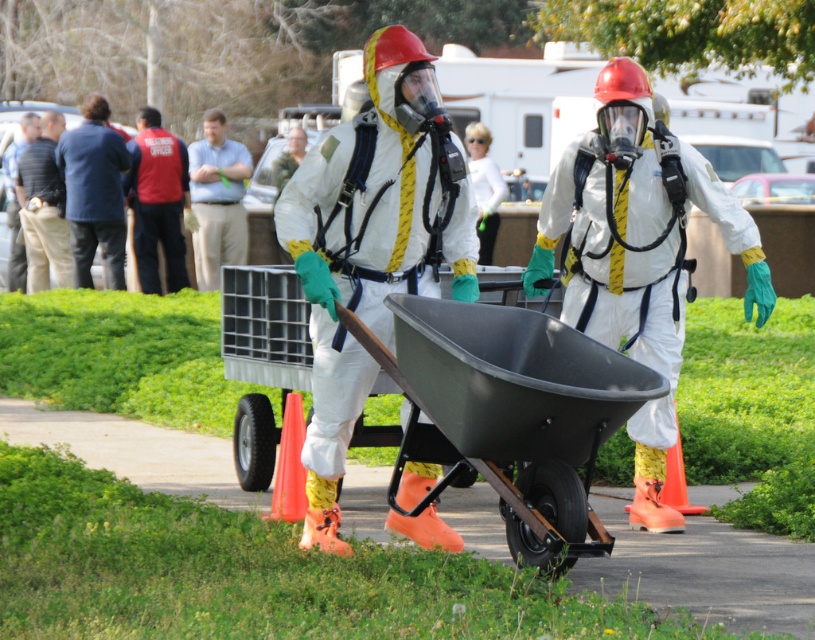
You are standing in front of the image and want to determine which of the two points, point (613, 378) or point (29, 289), is closer to you. Based on the scene, can you identify the closer point?

Point (613, 378) is closer to the viewer than point (29, 289).

You are a photographer at the scene. You want to take a photo that includes both the dark blue denim jacket at left and the light blue shirt at center. Which one should you focus on first to ensure both are in the frame?

Since the dark blue denim jacket at left is below the light blue shirt at center, you should focus on the light blue shirt at center first to ensure both are captured in the frame.